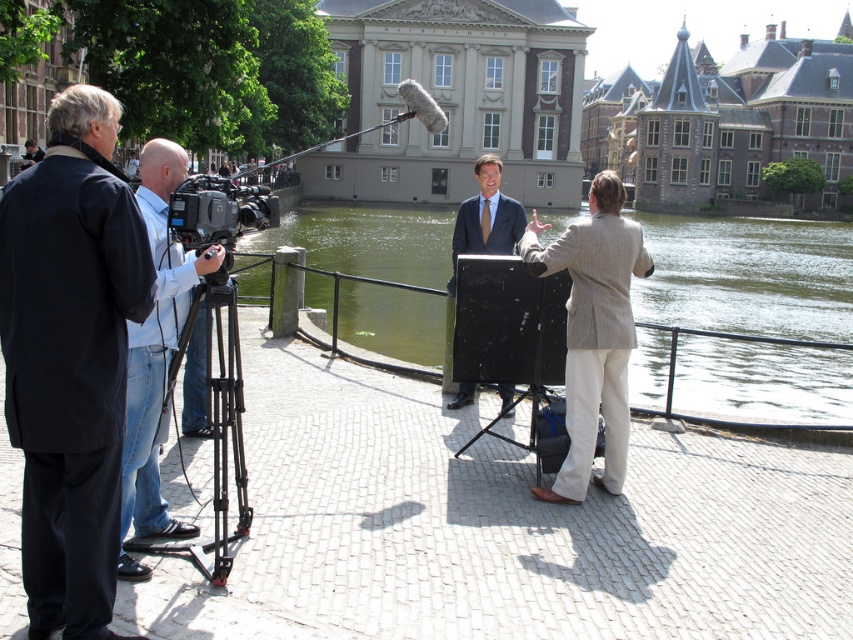
You are a photographer trying to capture a photo of the light gray textured blazer at center without including the stone gray building at upper center in the frame. Is this possible given their positions?

The stone gray building at upper center is positioned over the light gray textured blazer at center, so it would block the view. Therefore, capturing the light gray textured blazer at center without the stone gray building at upper center in the frame is not possible.

You are a photographer positioned at the edge of the canal. You need to capture a photo that includes both the stone gray building at upper center and the light gray textured blazer at center. Based on their positions, which object should be placed on the right side of the photo frame to ensure both are included?

The stone gray building at upper center should be placed on the right side of the photo frame because it is already positioned to the right of the light gray textured blazer at center, ensuring both are included in the frame.

You are a costume designer preparing for a play. You have two items from the scene to choose from for the main character. The items are the dark blue wool coat at left and the denim jeans at left. Which item would you select if you want the costume to appear more voluminous?

The dark blue wool coat at left has a larger size compared to denim jeans at left, so it would be the better choice for a more voluminous costume.